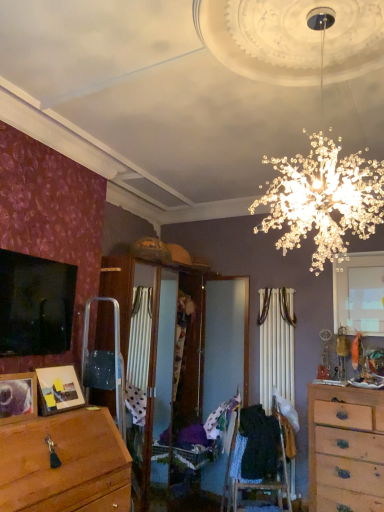
Question: Is wooden photo frame at lower left far from white matte window at upper right?

Choices:
 (A) no
 (B) yes

Answer: (B)

Question: Is wooden photo frame at lower left smaller than white matte window at upper right?

Choices:
 (A) yes
 (B) no

Answer: (A)

Question: Would you say wooden photo frame at lower left contains white matte window at upper right?

Choices:
 (A) yes
 (B) no

Answer: (B)

Question: From the image's perspective, is wooden photo frame at lower left below white matte window at upper right?

Choices:
 (A) no
 (B) yes

Answer: (B)

Question: Is the depth of wooden photo frame at lower left less than that of white matte window at upper right?

Choices:
 (A) no
 (B) yes

Answer: (B)

Question: Does wooden photo frame at lower left lie behind white matte window at upper right?

Choices:
 (A) yes
 (B) no

Answer: (B)

Question: From the image's perspective, would you say black fabric at center, marked as the 1th clothing in a right-to-left arrangement, is shown under wooden chest of drawers at right?

Choices:
 (A) yes
 (B) no

Answer: (B)

Question: Considering the relative sizes of black fabric at center, marked as the 1th clothing in a right-to-left arrangement, and wooden chest of drawers at right in the image provided, is black fabric at center, marked as the 1th clothing in a right-to-left arrangement, thinner than wooden chest of drawers at right?

Choices:
 (A) no
 (B) yes

Answer: (B)

Question: Is black fabric at center, which is the second clothing from left to right, facing away from wooden chest of drawers at right?

Choices:
 (A) yes
 (B) no

Answer: (B)

Question: Is black fabric at center, which is the second clothing from left to right, positioned behind wooden chest of drawers at right?

Choices:
 (A) no
 (B) yes

Answer: (B)

Question: From the image's perspective, is black fabric at center, marked as the 1th clothing in a right-to-left arrangement, on top of wooden chest of drawers at right?

Choices:
 (A) no
 (B) yes

Answer: (B)

Question: Considering the relative sizes of black fabric at center, which is the second clothing from left to right, and wooden chest of drawers at right in the image provided, is black fabric at center, which is the second clothing from left to right, shorter than wooden chest of drawers at right?

Choices:
 (A) yes
 (B) no

Answer: (A)

Question: Considering the relative sizes of white matte window at upper right and patterned fabric at center, acting as the second clothing starting from the right, in the image provided, is white matte window at upper right taller than patterned fabric at center, acting as the second clothing starting from the right,?

Choices:
 (A) no
 (B) yes

Answer: (B)